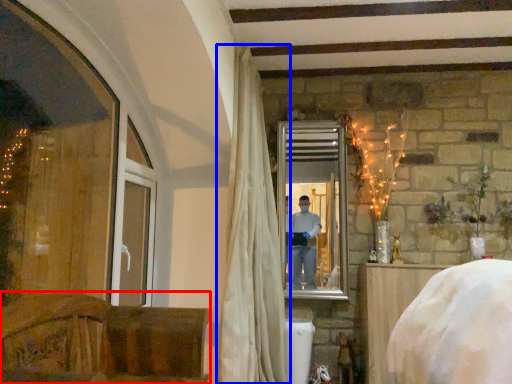
Question: Which of the following is the closest to the observer, furniture (highlighted by a red box) or curtain (highlighted by a blue box)?

Choices:
 (A) furniture
 (B) curtain

Answer: (A)